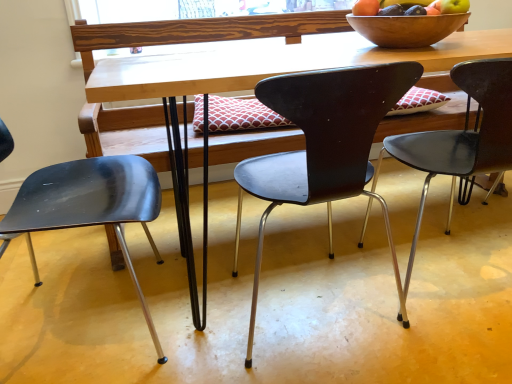
This screenshot has width=512, height=384. Find the location of `vacant space that's between matte black chair at center, arranged as the first chair when viewed from the right, and matte black chair at center, the 2th chair positioned from the left`. vacant space that's between matte black chair at center, arranged as the first chair when viewed from the right, and matte black chair at center, the 2th chair positioned from the left is located at coordinates (434, 317).